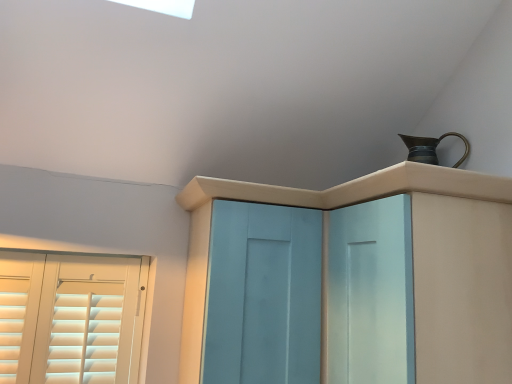
Question: Is bronze metallic jug at upper right a part of light blue wood cupboard at upper center?

Choices:
 (A) no
 (B) yes

Answer: (A)

Question: From a real-world perspective, does light blue wood cupboard at upper center sit lower than bronze metallic jug at upper right?

Choices:
 (A) yes
 (B) no

Answer: (A)

Question: Could you tell me if light blue wood cupboard at upper center is facing bronze metallic jug at upper right?

Choices:
 (A) yes
 (B) no

Answer: (B)

Question: From the image's perspective, is light blue wood cupboard at upper center over bronze metallic jug at upper right?

Choices:
 (A) no
 (B) yes

Answer: (A)

Question: Does light blue wood cupboard at upper center have a larger size compared to bronze metallic jug at upper right?

Choices:
 (A) no
 (B) yes

Answer: (B)

Question: Considering their positions, is light blue wood screen door at center located in front of or behind bronze metallic jug at upper right?

Choices:
 (A) behind
 (B) front

Answer: (B)

Question: Does point (250, 266) appear closer or farther from the camera than point (431, 162)?

Choices:
 (A) farther
 (B) closer

Answer: (B)

Question: Looking at the image, does light blue wood screen door at center seem bigger or smaller compared to bronze metallic jug at upper right?

Choices:
 (A) big
 (B) small

Answer: (A)

Question: Is light blue wood screen door at center wider or thinner than bronze metallic jug at upper right?

Choices:
 (A) wide
 (B) thin

Answer: (A)

Question: From a real-world perspective, is bronze metallic jug at upper right positioned above or below light blue wood cupboard at upper center?

Choices:
 (A) above
 (B) below

Answer: (A)

Question: Considering the positions of bronze metallic jug at upper right and light blue wood cupboard at upper center in the image, is bronze metallic jug at upper right wider or thinner than light blue wood cupboard at upper center?

Choices:
 (A) thin
 (B) wide

Answer: (A)

Question: Would you say bronze metallic jug at upper right is to the left or to the right of light blue wood cupboard at upper center in the picture?

Choices:
 (A) left
 (B) right

Answer: (B)

Question: Considering the positions of bronze metallic jug at upper right and light blue wood cupboard at upper center in the image, is bronze metallic jug at upper right bigger or smaller than light blue wood cupboard at upper center?

Choices:
 (A) small
 (B) big

Answer: (A)

Question: Considering the relative positions of light blue wood cupboard at upper center and light blue wood screen door at center in the image provided, is light blue wood cupboard at upper center to the left or to the right of light blue wood screen door at center?

Choices:
 (A) right
 (B) left

Answer: (A)

Question: Is light blue wood cupboard at upper center taller or shorter than light blue wood screen door at center?

Choices:
 (A) tall
 (B) short

Answer: (A)